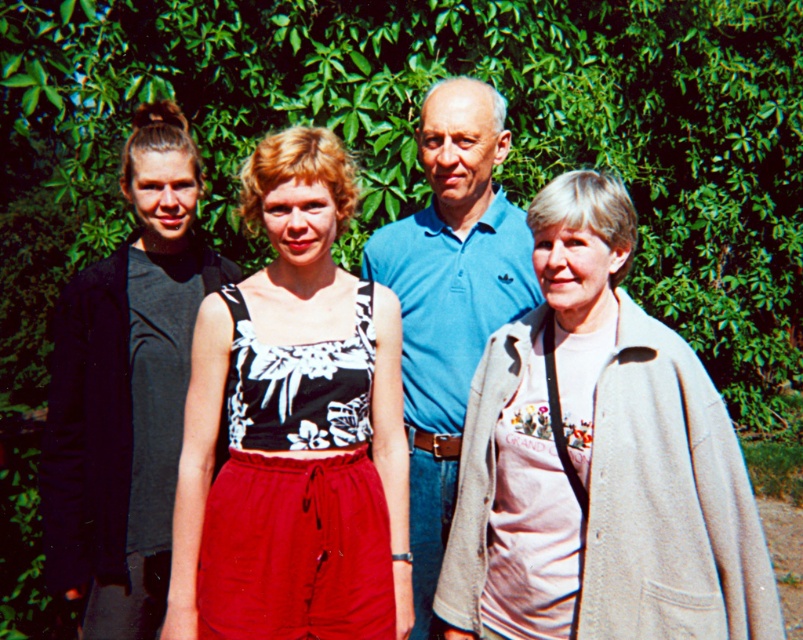
Based on the scene description, where exactly is the light beige woolen coat at center located in the image?

The light beige woolon coat at center is located at point (x=598, y=460) in the image.

You are a photographer setting up for a group photo. You need to arrange the light beige woolen coat at center and the black matte tank top at left so that both are visible in the frame. Given their heights, which one should be placed in a position that requires less elevation adjustment to ensure their faces are at the same level?

Answer: The light beige woolen coat at center is not as tall as the black matte tank top at left, so to have their faces at the same level, the light beige woolen coat at center should be placed on a higher platform while the black matte tank top at left remains lower.